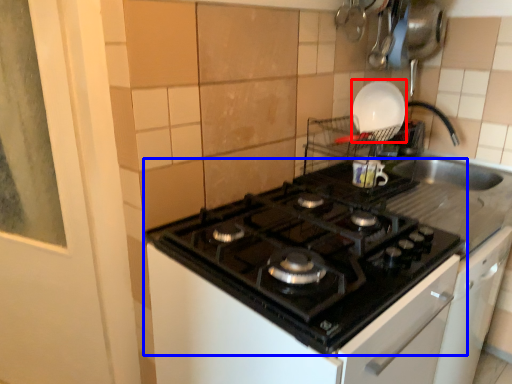
Question: Which point is closer to the camera, kitchen appliance (highlighted by a red box) or gas stove (highlighted by a blue box)?

Choices:
 (A) kitchen appliance
 (B) gas stove

Answer: (B)